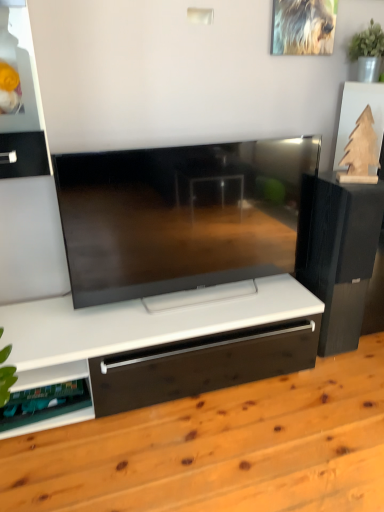
Question: From the image's perspective, is black matte speaker at right over wooden floor at center?

Choices:
 (A) yes
 (B) no

Answer: (A)

Question: Is black matte speaker at right positioned in front of wooden floor at center?

Choices:
 (A) no
 (B) yes

Answer: (A)

Question: Considering the relative sizes of black matte speaker at right and wooden floor at center in the image provided, is black matte speaker at right taller than wooden floor at center?

Choices:
 (A) yes
 (B) no

Answer: (A)

Question: Can you confirm if black matte speaker at right is positioned to the right of wooden floor at center?

Choices:
 (A) no
 (B) yes

Answer: (B)

Question: Is black matte speaker at right next to wooden floor at center?

Choices:
 (A) no
 (B) yes

Answer: (A)

Question: In the image, is green plastic shelf at lower left positioned in front of or behind black matte speaker at right?

Choices:
 (A) behind
 (B) front

Answer: (B)

Question: Considering the positions of green plastic shelf at lower left and black matte speaker at right in the image, is green plastic shelf at lower left taller or shorter than black matte speaker at right?

Choices:
 (A) short
 (B) tall

Answer: (A)

Question: From the image's perspective, relative to black matte speaker at right, is green plastic shelf at lower left above or below?

Choices:
 (A) above
 (B) below

Answer: (B)

Question: Does point (87, 370) appear closer or farther from the camera than point (326, 271)?

Choices:
 (A) closer
 (B) farther

Answer: (A)

Question: Looking at the image, does black matte speaker at right seem bigger or smaller compared to wooden floor at center?

Choices:
 (A) big
 (B) small

Answer: (B)

Question: From the image's perspective, is black matte speaker at right located above or below wooden floor at center?

Choices:
 (A) below
 (B) above

Answer: (B)

Question: In the image, is black matte speaker at right on the left side or the right side of wooden floor at center?

Choices:
 (A) left
 (B) right

Answer: (B)

Question: In terms of width, does black matte speaker at right look wider or thinner when compared to wooden floor at center?

Choices:
 (A) wide
 (B) thin

Answer: (B)

Question: Relative to wooden floor at center, is green plastic shelf at lower left in front or behind?

Choices:
 (A) behind
 (B) front

Answer: (A)

Question: Is green plastic shelf at lower left taller or shorter than wooden floor at center?

Choices:
 (A) short
 (B) tall

Answer: (A)